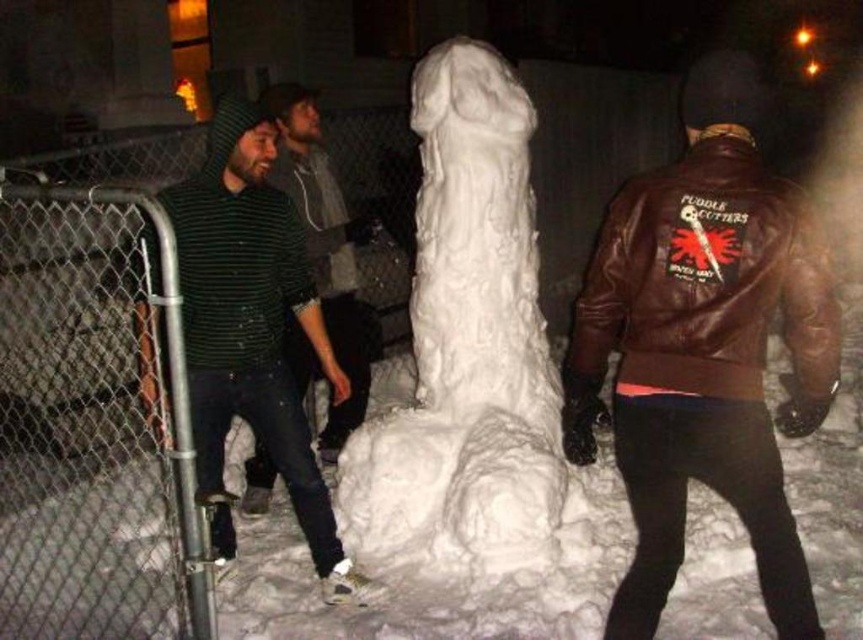
Is point (227, 182) farther from camera compared to point (341, 237)?

No, it is in front of (341, 237).

Is green striped sweater at left shorter than green striped sweater at center?

Yes.

Identify the location of green striped sweater at left. (252, 332).

Who is shorter, brown leather jacket at center or white fluffy snowman at center?

brown leather jacket at center is shorter.

Which is above, brown leather jacket at center or white fluffy snowman at center?

white fluffy snowman at center is higher up.

Locate an element on the screen. The width and height of the screenshot is (863, 640). brown leather jacket at center is located at coordinates (704, 348).

Does brown leather jacket at center lie in front of green striped sweater at left?

Yes, it is.

Between point (766, 458) and point (244, 276), which one is positioned behind?

Point (244, 276)

The height and width of the screenshot is (640, 863). I want to click on brown leather jacket at center, so click(704, 348).